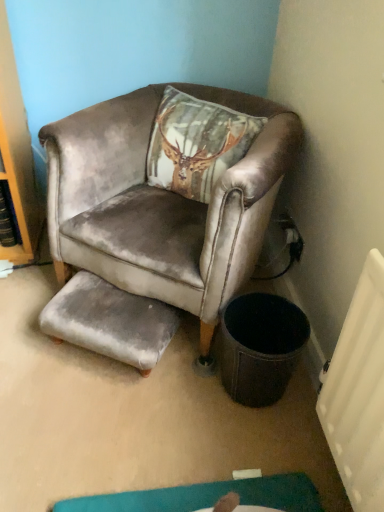
This screenshot has height=512, width=384. Identify the location of blank space to the left of gray velvet footrest at lower center. (28, 336).